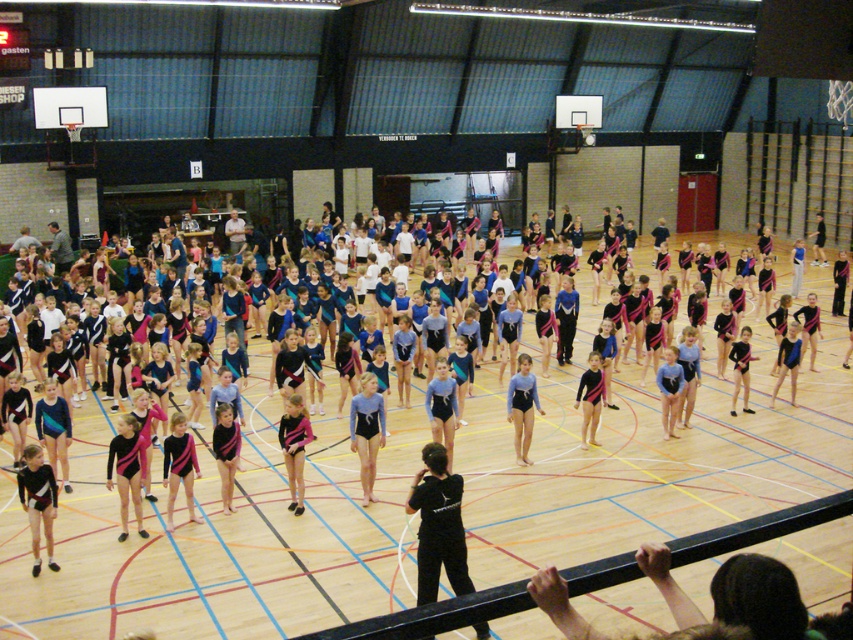
Question: Which of these objects is positioned farthest from the blue leotard at center?

Choices:
 (A) black matte/black uniform at center
 (B) blue matte leotard at center

Answer: (A)

Question: Can you confirm if black matte/black uniform at center is positioned below blue matte leotard at center?

Choices:
 (A) yes
 (B) no

Answer: (A)

Question: Is blue leotard at center positioned at the back of blue matte leotard at center?

Choices:
 (A) no
 (B) yes

Answer: (A)

Question: Which point is farther to the camera?

Choices:
 (A) blue matte leotard at center
 (B) blue leotard at center
 (C) black matte/black uniform at center

Answer: (A)

Question: Is blue leotard at center thinner than blue matte leotard at center?

Choices:
 (A) yes
 (B) no

Answer: (A)

Question: Which object is positioned farthest from the blue matte leotard at center?

Choices:
 (A) blue leotard at center
 (B) black matte/black uniform at center

Answer: (B)